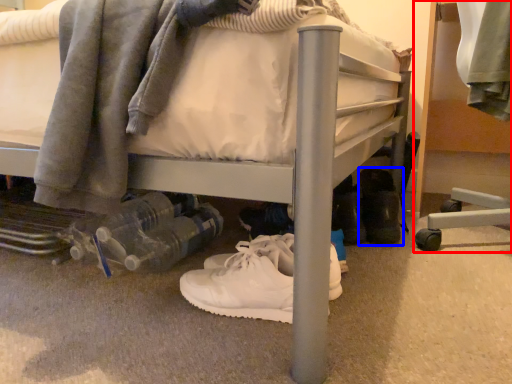
Question: Which object is further to the camera taking this photo, furniture (highlighted by a red box) or footwear (highlighted by a blue box)?

Choices:
 (A) furniture
 (B) footwear

Answer: (A)